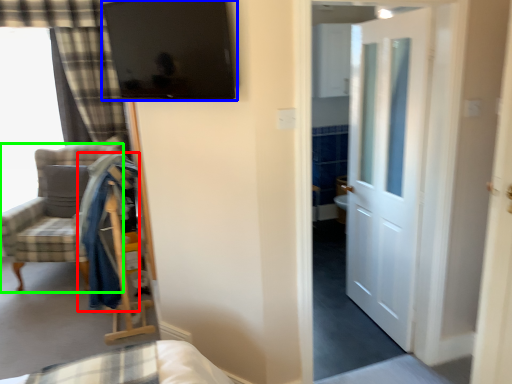
Question: Estimate the real-world distances between objects in this image. Which object is farther from robe (highlighted by a red box), window screen (highlighted by a blue box) or chair (highlighted by a green box)?

Choices:
 (A) window screen
 (B) chair

Answer: (A)